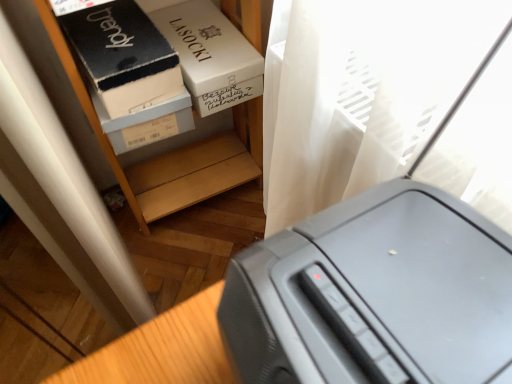
Locate an element on the screen. This screenshot has width=512, height=384. free spot above gray plastic printer at lower right (from a real-world perspective) is located at coordinates (384, 278).